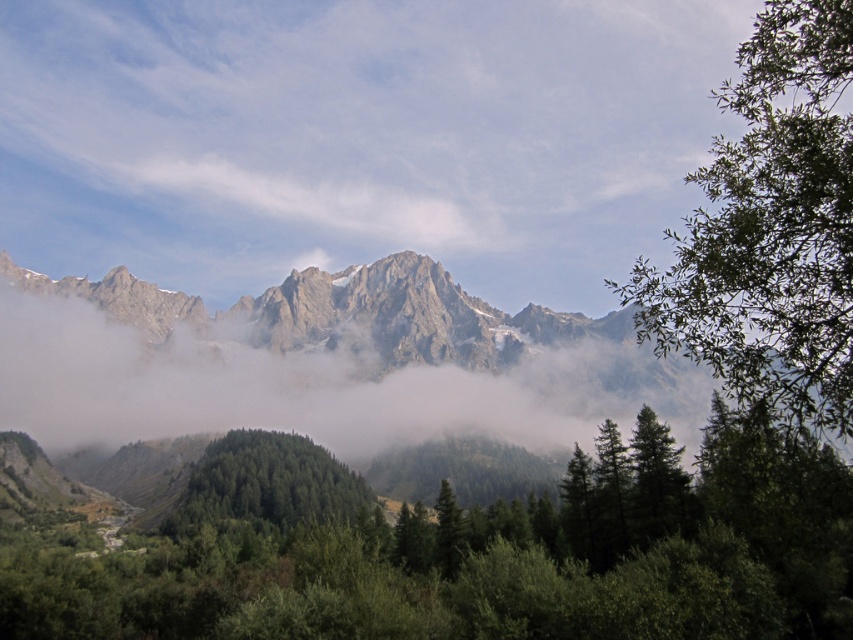
Is green leafy tree at right taller than white fluffy cloud at upper center?

Yes, green leafy tree at right is taller than white fluffy cloud at upper center.

Which is in front, point (819, 301) or point (451, 236)?

Point (819, 301) is in front.

This screenshot has width=853, height=640. What are the coordinates of `green leafy tree at right` in the screenshot? It's located at (770, 228).

Is green leafy tree at right bigger than green matte forest at center?

Correct, green leafy tree at right is larger in size than green matte forest at center.

Which is in front, point (827, 404) or point (344, 496)?

Positioned in front is point (827, 404).

You are a GUI agent. You are given a task and a screenshot of the screen. Output one action in this format:
    pyautogui.click(x=<x>, y=<y>)
    Task: Click on the green leafy tree at right
    
    Given the screenshot: What is the action you would take?
    pyautogui.click(x=770, y=228)

Between rocky gray mountain range at upper center and green matte forest at center, which one is positioned higher?

rocky gray mountain range at upper center is above.

Can you confirm if rocky gray mountain range at upper center is shorter than green matte forest at center?

Incorrect, rocky gray mountain range at upper center's height does not fall short of green matte forest at center's.

The width and height of the screenshot is (853, 640). What do you see at coordinates (321, 362) in the screenshot?
I see `rocky gray mountain range at upper center` at bounding box center [321, 362].

Where is `rocky gray mountain range at upper center`? The height and width of the screenshot is (640, 853). rocky gray mountain range at upper center is located at coordinates (321, 362).